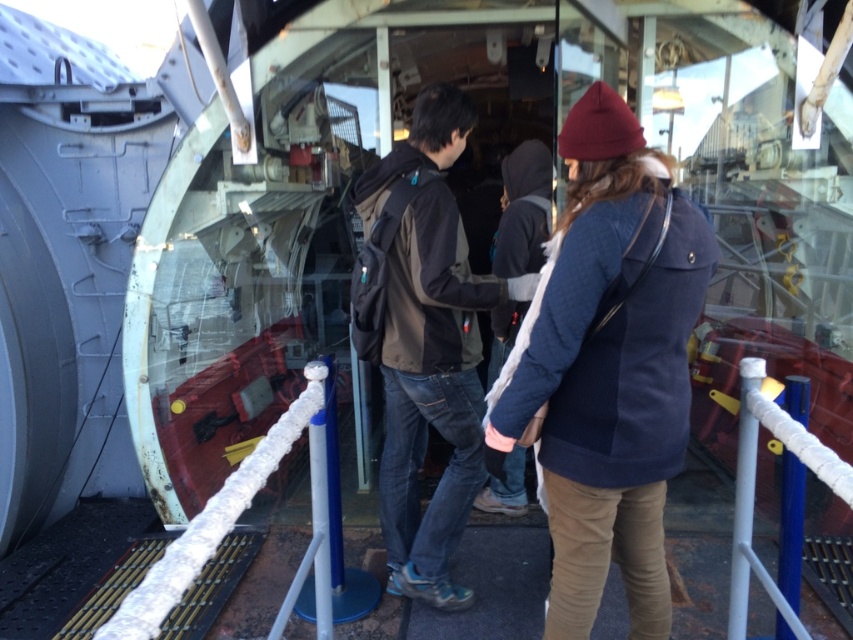
You are a photographer positioned at the edge of the large circular opening in the ship. You need to capture a photo that includes both the dark brown backpack at center and the white rope at lower left. Which object will appear closer to the camera in the final photo?

The dark brown backpack at center will appear closer to the camera in the photo because it is positioned further to the viewer than the white rope at lower left.

You are a photographer trying to capture a photo of the dark brown backpack at center without including the navy blue jacket at center in the frame. Based on their positions, which direction should you move your camera to the left or right?

The navy blue jacket at center is to the right of the dark brown backpack at center, so to exclude the navy blue jacket at center from the frame, you should move your camera to the right.